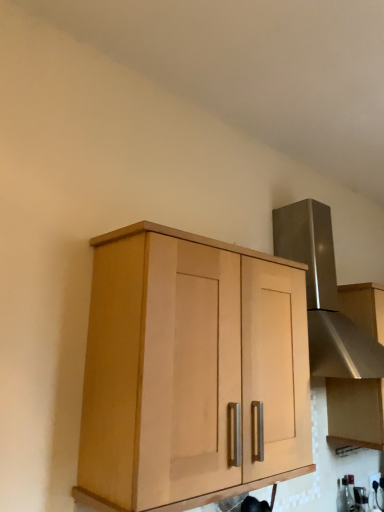
Question: From the image's perspective, is clear glass bottle at lower right located above or below satin silver vent at upper right?

Choices:
 (A) above
 (B) below

Answer: (B)

Question: Is point (339, 505) positioned closer to the camera than point (322, 302)?

Choices:
 (A) closer
 (B) farther

Answer: (B)

Question: Which object is the farthest from the satin silver vent at upper right?

Choices:
 (A) clear glass bottle at lower right
 (B) white glossy electric outlet at lower right
 (C) satin silver hood at upper right, acting as the 1th cabinetry starting from the back
 (D) light wood cabinet at center, which is counted as the 2th cabinetry, starting from the back

Answer: (B)

Question: Which is farther from the white glossy electric outlet at lower right?

Choices:
 (A) satin silver hood at upper right, arranged as the second cabinetry when viewed from the front
 (B) light wood cabinet at center, the first cabinetry from the front
 (C) clear glass bottle at lower right
 (D) satin silver vent at upper right

Answer: (B)